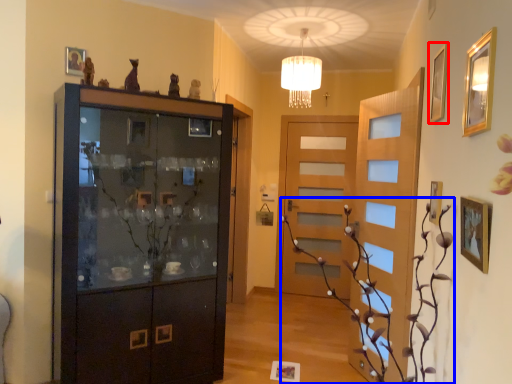
Question: Among these objects, which one is farthest to the camera, picture frame (highlighted by a red box) or plant (highlighted by a blue box)?

Choices:
 (A) picture frame
 (B) plant

Answer: (A)